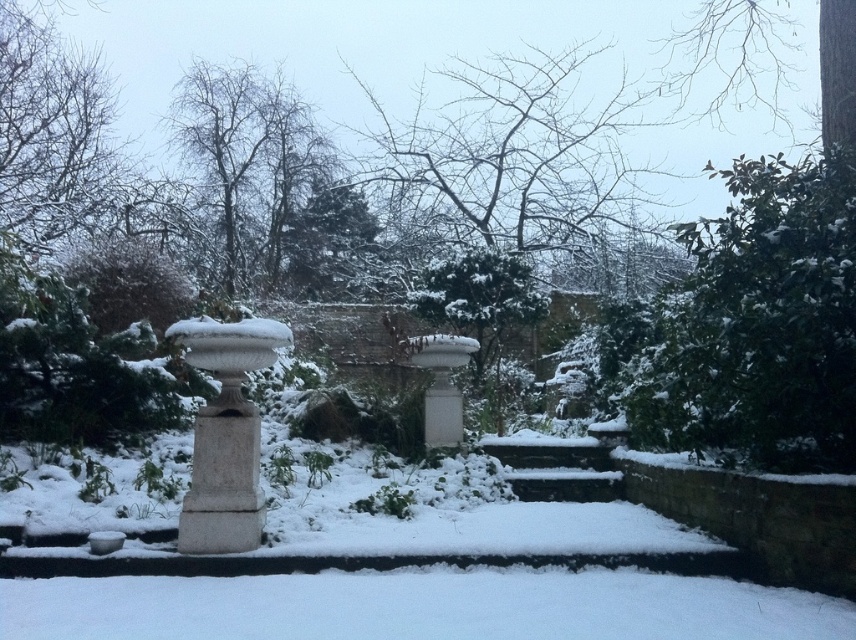
You are a gardener planning to place a new statue that is 3 meters tall in this winter garden scene. Considering the existing objects, which one is taller between the green leafy tree at upper right and the white stone urn at left, and would the statue fit in terms of height?

The green leafy tree at upper right is taller than the white stone urn at left. Since the statue is 3 meters tall, it could potentially fit in the scene as long as its placement doesn

You are standing at the center of the snowy pathway in the winter scene. You want to take a photo of the green leafy tree at upper right. In which direction should you point your camera?

The green leafy tree at upper right is located at point coordinates of (759, 324), which means it is positioned towards the upper right direction from your current position at the center of the pathway. Therefore, you should point your camera towards the upper right direction to capture the tree in the photo.